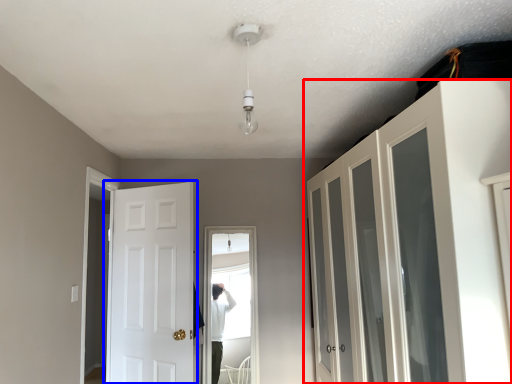
Question: Among these objects, which one is farthest to the camera, cupboard (highlighted by a red box) or door (highlighted by a blue box)?

Choices:
 (A) cupboard
 (B) door

Answer: (B)